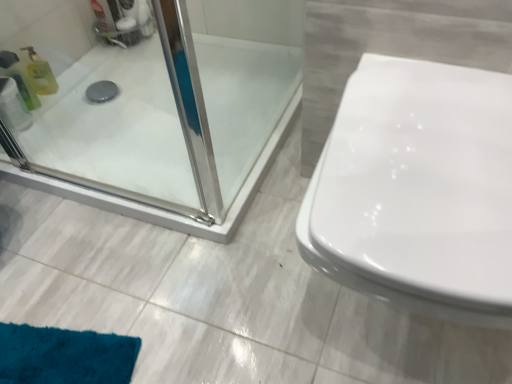
Locate an element on the screen. Image resolution: width=512 pixels, height=384 pixels. vacant region to the left of white glossy toilet at right is located at coordinates (212, 293).